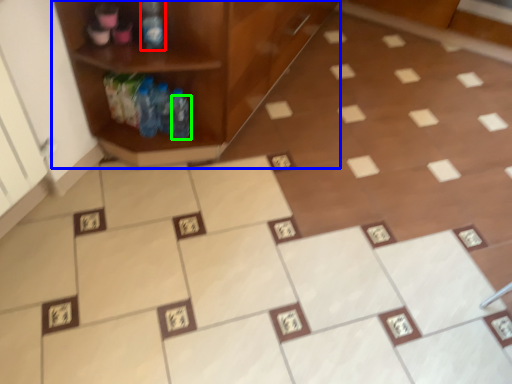
Question: Based on their relative distances, which object is farther from bottle (highlighted by a red box)? Choose from shelf (highlighted by a blue box) and bottle (highlighted by a green box).

Choices:
 (A) shelf
 (B) bottle

Answer: (B)